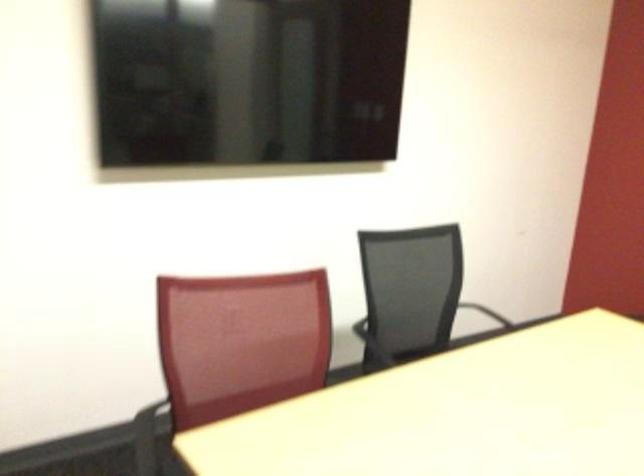
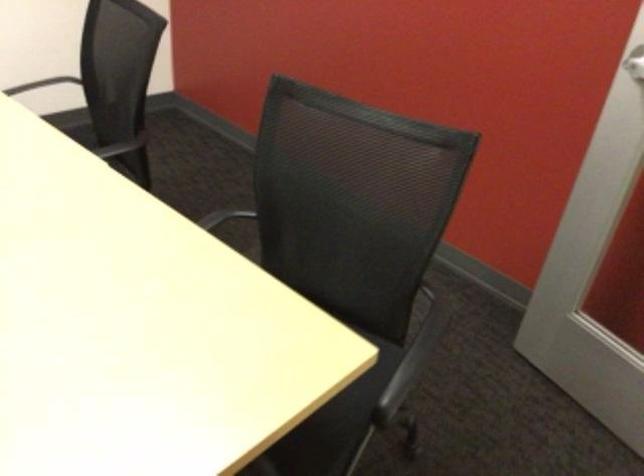
Question: The images are taken continuously from a first-person perspective. In which direction are you moving?

Choices:
 (A) Left
 (B) Right
 (C) Forward
 (D) Backward

Answer: (B)